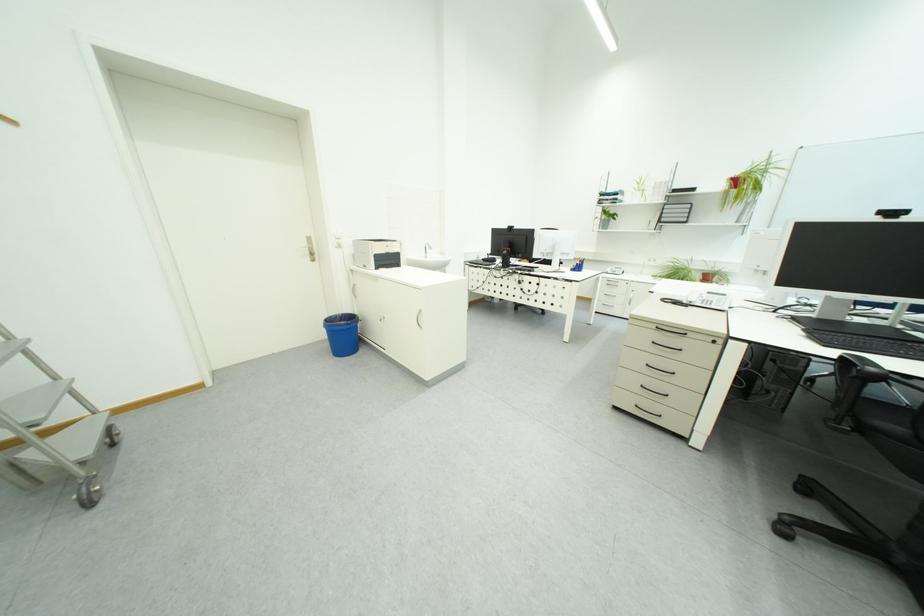
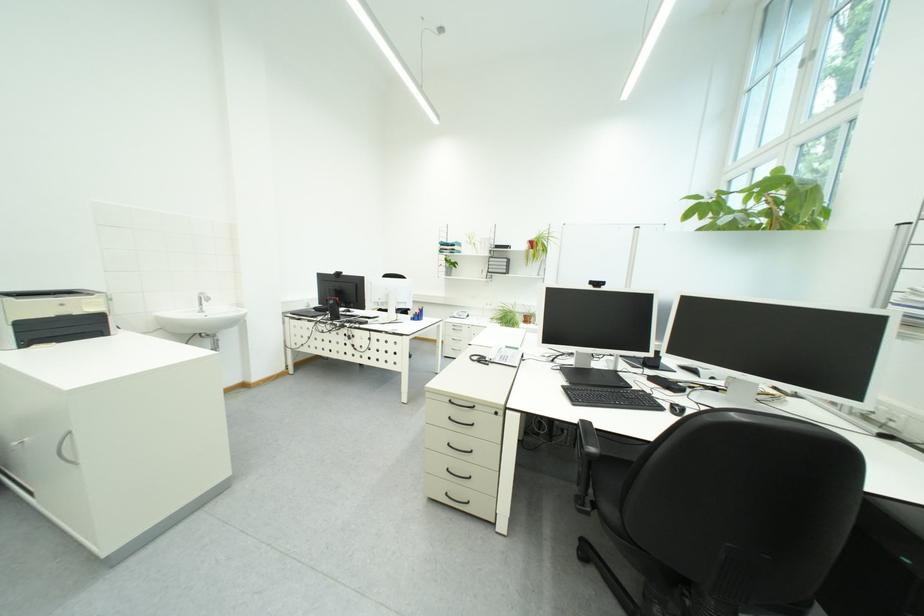
The point at (558,256) is marked in the first image. Where is the corresponding point in the second image?

(394, 305)